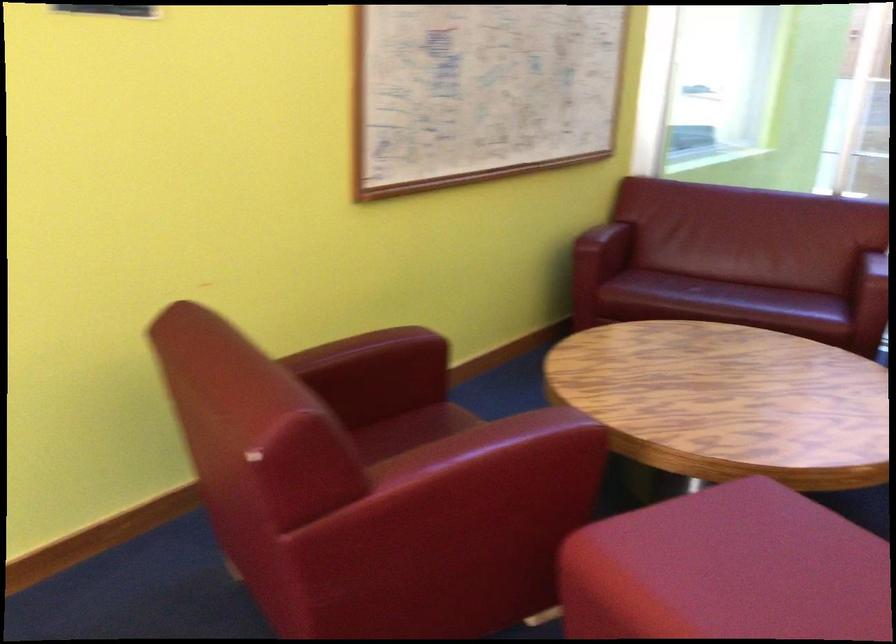
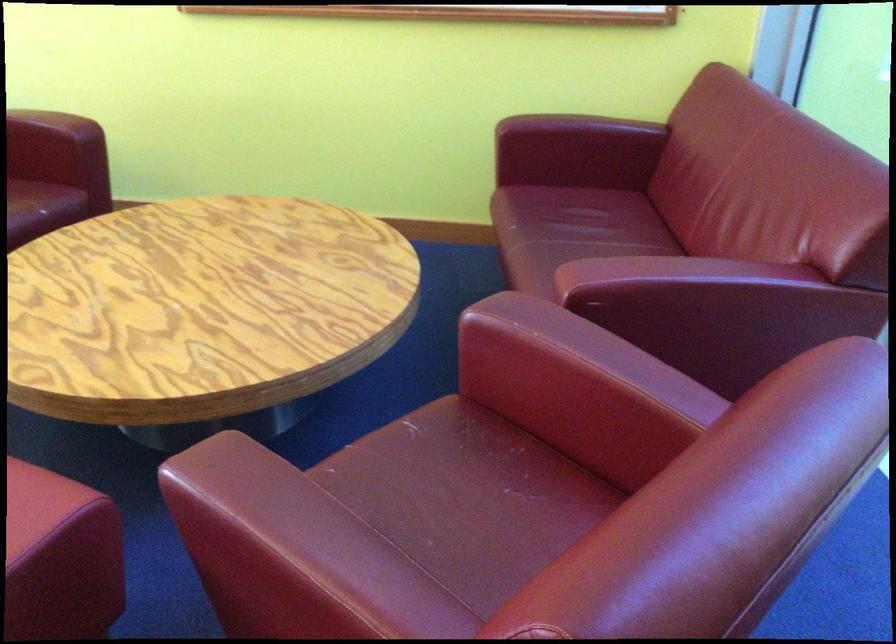
In the second image, find the point that corresponds to pixel 616 222 in the first image.

(582, 127)